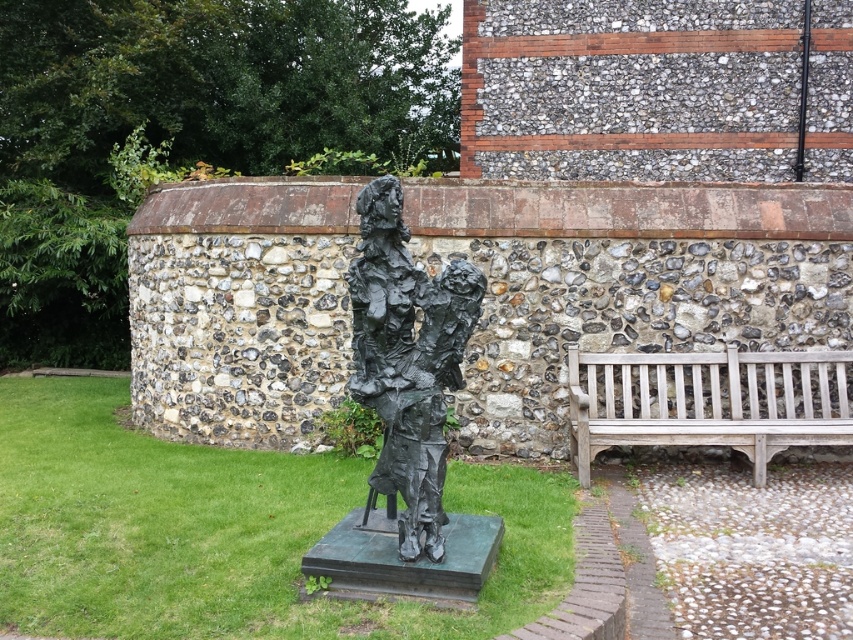
Is bronze statue at center shorter than wooden bench at right?

No, bronze statue at center is not shorter than wooden bench at right.

Locate an element on the screen. bronze statue at center is located at coordinates (407, 360).

Between point (384, 417) and point (714, 403), which one is positioned behind?

The point (714, 403) is behind.

Locate an element on the screen. bronze statue at center is located at coordinates (407, 360).